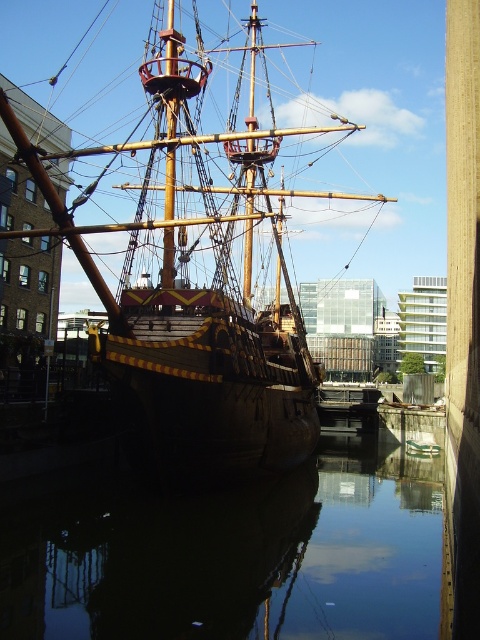
You are a photographer planning to take a photo of the wooden ship at center and the smooth dark water at center. Based on their sizes, which object should you focus on to ensure both are clearly visible in the frame?

The wooden ship at center is bigger than smooth dark water at center, so focusing on the wooden ship at center will ensure both are clearly visible in the frame since it occupies more space.

You are a tour guide explaining the ship to visitors. Pointing to the wooden ship at center and the smooth dark water at center, you want to describe their positions relative to each other. How would you phrase this?

The wooden ship at center is positioned to the left of the smooth dark water at center.